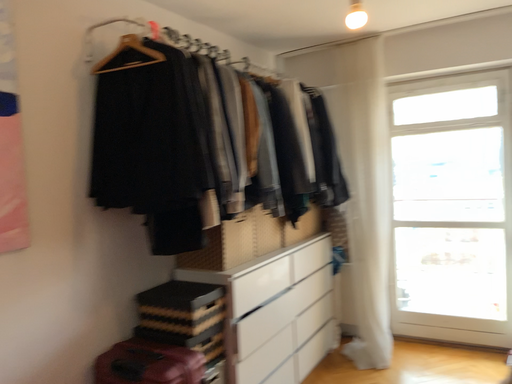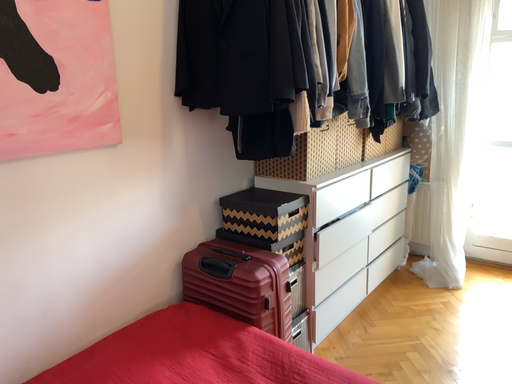
Question: Which way did the camera rotate in the video?

Choices:
 (A) rotated right
 (B) rotated left

Answer: (B)